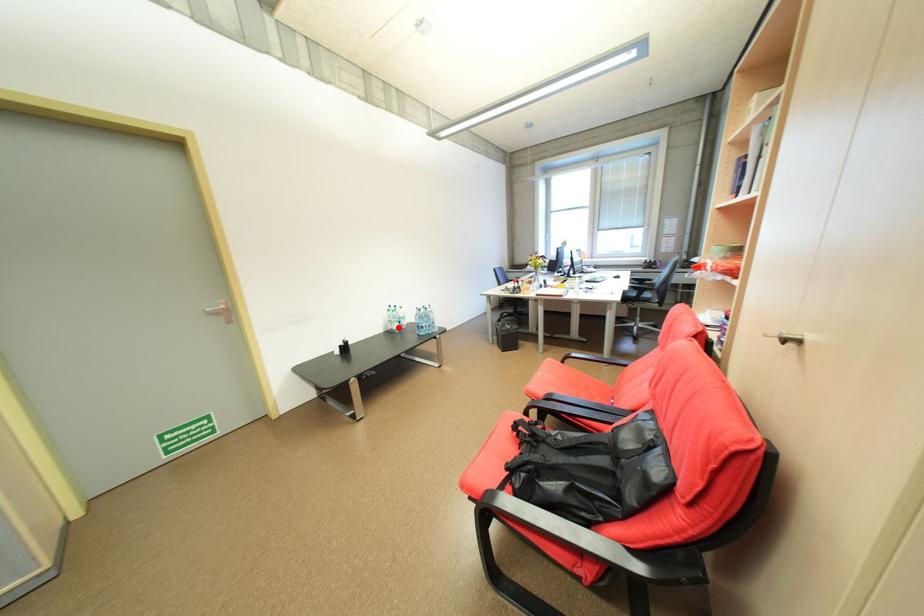
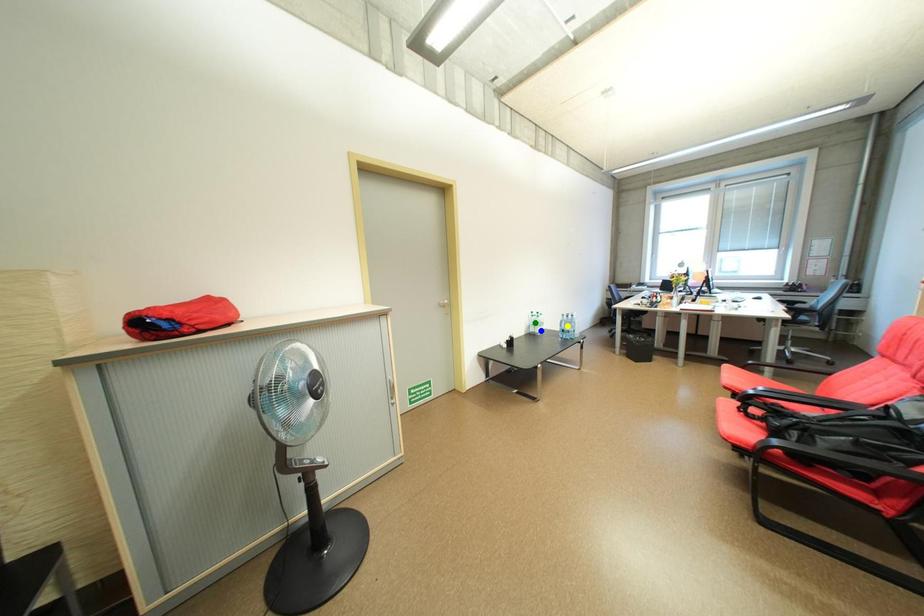
Question: I am providing you with two images of the same scene from different viewpoints. A red point is marked on the first image. You are given multiple points on the second image. Which point in image 2 represents the same 3d spot as the red point in image 1?

Choices:
 (A) green point
 (B) blue point
 (C) yellow point

Answer: (B)